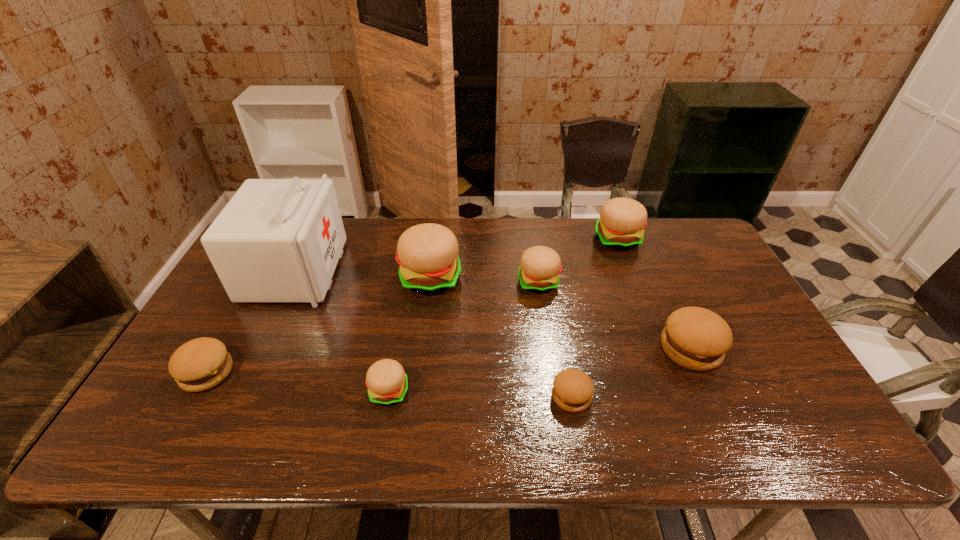
This screenshot has height=540, width=960. In the image, there is a desktop. Identify the location of free space at the far right corner. (702, 235).

In the image, there is a desktop. At what (x,y) coordinates should I click in order to perform the action: click on free region at the near right corner. Please return your answer as a coordinate pair (x, y). Looking at the image, I should click on 793,447.

In order to click on free space between the white first-aid kit and the second biggest brown hamburger in this screenshot , I will do `click(251, 322)`.

Where is `free space between the shortest hamburger and the tallest hamburger`? free space between the shortest hamburger and the tallest hamburger is located at coordinates (501, 337).

At what (x,y) coordinates should I click in order to perform the action: click on blank region between the rightmost beige hamburger and the shortest object. Please return your answer as a coordinate pair (x, y). The width and height of the screenshot is (960, 540). Looking at the image, I should click on (594, 318).

Locate an element on the screen. free point between the second smallest brown hamburger and the biggest brown hamburger is located at coordinates (448, 360).

In order to click on free space between the rightmost brown hamburger and the biggest beige hamburger in this screenshot , I will do `click(561, 313)`.

The image size is (960, 540). I want to click on unoccupied area between the second biggest brown hamburger and the third beige hamburger from left to right, so click(x=372, y=327).

Find the location of `blank region between the tallest object and the second tallest object`. blank region between the tallest object and the second tallest object is located at coordinates (363, 275).

Image resolution: width=960 pixels, height=540 pixels. In order to click on free space between the smallest brown hamburger and the second beige hamburger from right to left in this screenshot , I will do `click(555, 339)`.